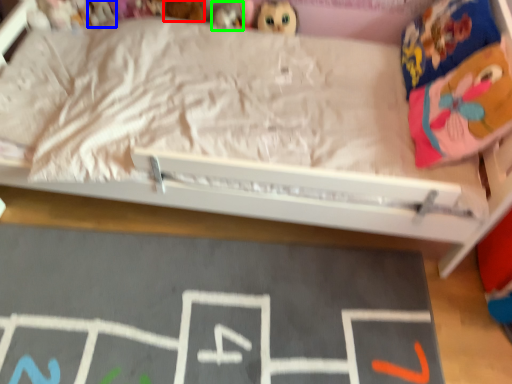
Question: Estimate the real-world distances between objects in this image. Which object is closer to toy (highlighted by a red box), toy (highlighted by a blue box) or toy (highlighted by a green box)?

Choices:
 (A) toy
 (B) toy

Answer: (B)